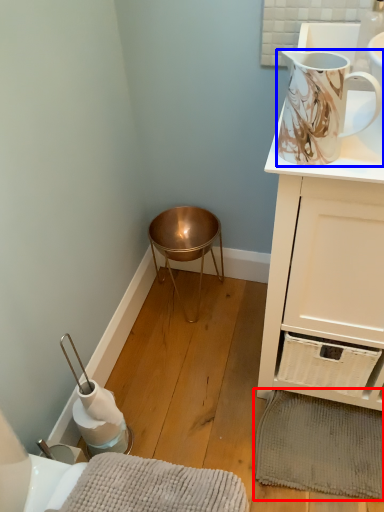
Question: Which of the following is the closest to the observer, bath mat (highlighted by a red box) or jug (highlighted by a blue box)?

Choices:
 (A) bath mat
 (B) jug

Answer: (B)